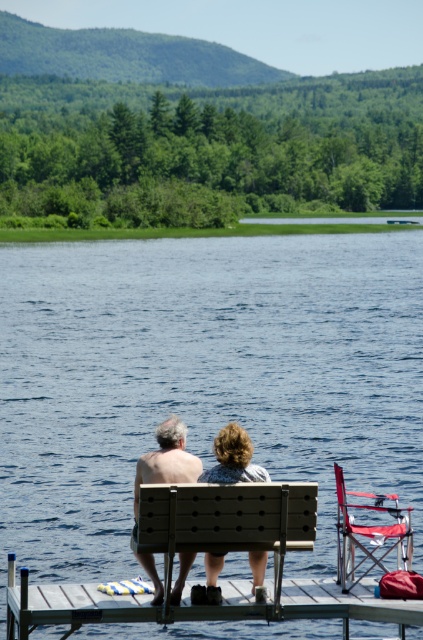
You are standing at the point with coordinates (74, 605) in the image. What object are you currently standing on?

The wooden dock at lower center is located at point (74, 605), so you are standing on the wooden dock at lower center.

You are standing on the wooden dock at lower center and want to reach the matte gray shorts at center. Which direction should you move to get closer to the shorts?

Since the wooden dock at lower center is closer to the viewer than the matte gray shorts at center, you should move forward towards the shorts to get closer.

You are planning to place a small cooler on the wooden dock at lower center. Considering the space occupied by the matte gray shorts at center, can you determine if there is enough room for the cooler?

The wooden dock at lower center might be wider than matte gray shorts at center, so there could be sufficient space for the cooler depending on the cooler size.